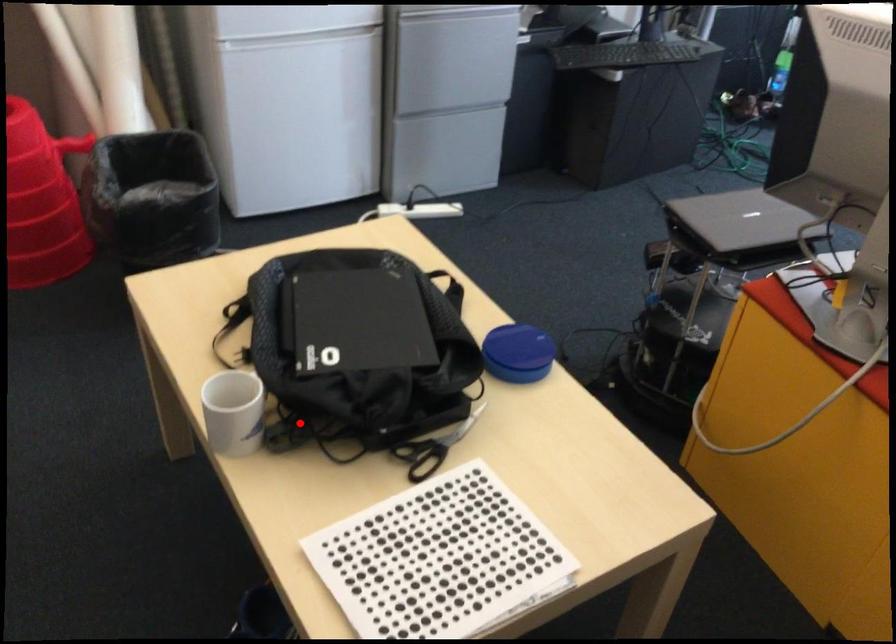
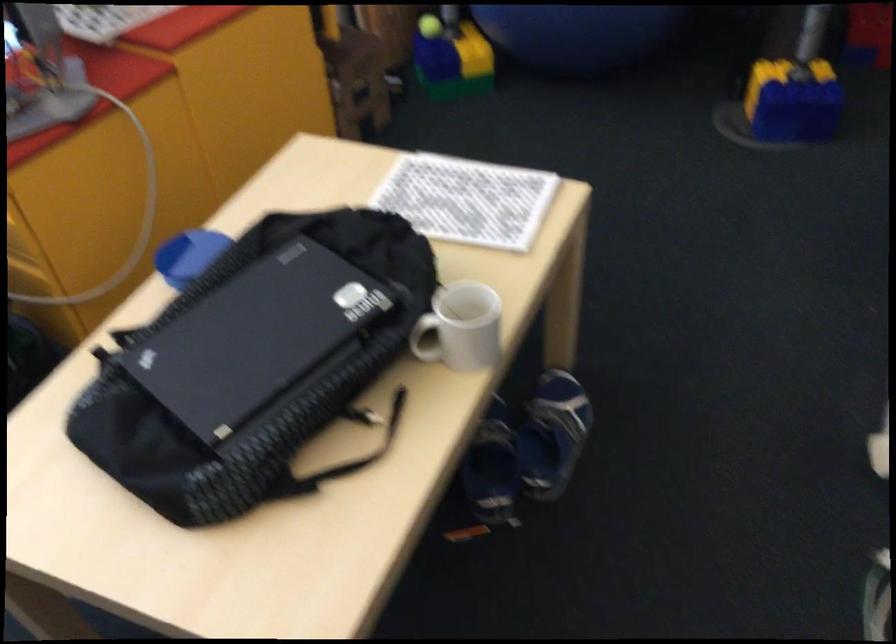
The point at the highlighted location is marked in the first image. Where is the corresponding point in the second image?

(426, 339)